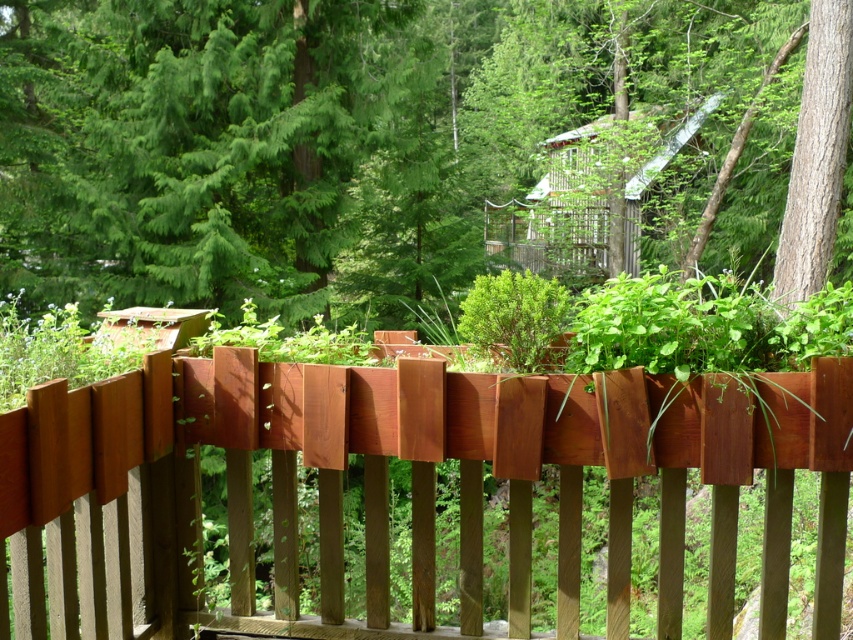
You are standing on a deck surrounded by greenery and see the green matte tree at center and the smooth brown tree trunk at right. Which tree appears larger in size?

The green matte tree at center appears larger in size than the smooth brown tree trunk at right.

You are standing on the deck and want to take a photo of the green matte tree at center. If your camera can focus up to 10 meters, will it be able to capture the tree clearly?

The green matte tree at center is 9.45 meters away from the camera, so yes, the camera can focus on it clearly since the distance is within its 10 meters range.